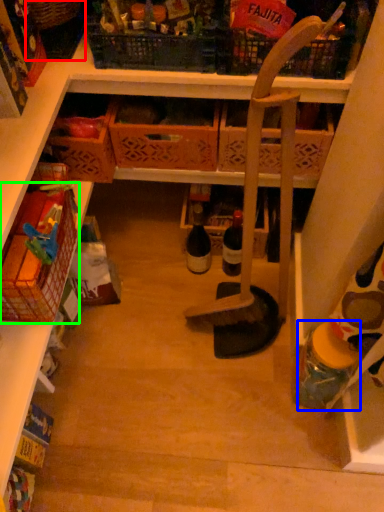
Question: Which object is the farthest from basket (highlighted by a red box)? Choose among these: bottle (highlighted by a blue box) or basket (highlighted by a green box).

Choices:
 (A) bottle
 (B) basket

Answer: (A)